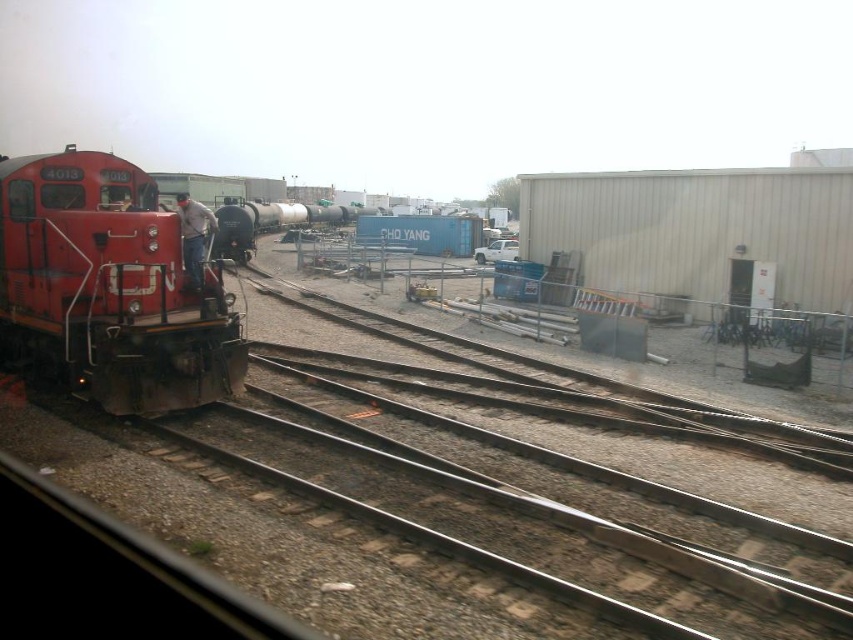
Question: Among these points, which one is nearest to the camera?

Choices:
 (A) (102, 193)
 (B) (183, 224)
 (C) (149, 264)
 (D) (228, 205)

Answer: (C)

Question: Is matte red train at left positioned at the back of black glossy tank car at center?

Choices:
 (A) no
 (B) yes

Answer: (A)

Question: Which point is closer to the camera?

Choices:
 (A) (316, 214)
 (B) (80, 204)

Answer: (B)

Question: Is matte red train at left below matte black train window at left?

Choices:
 (A) yes
 (B) no

Answer: (A)

Question: Which of the following is the farthest from the observer?

Choices:
 (A) matte red train at left
 (B) matte black train window at left
 (C) denim jacket at left
 (D) black glossy tank car at center

Answer: (B)

Question: In this image, where is black glossy tank car at center located relative to denim jacket at left?

Choices:
 (A) above
 (B) below

Answer: (B)